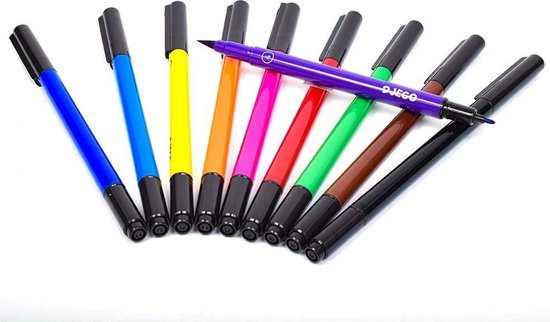
The width and height of the screenshot is (550, 322). I want to click on pen, so click(x=71, y=112), click(x=133, y=113), click(x=176, y=121), click(x=218, y=120), click(x=255, y=120), click(x=298, y=119), click(x=331, y=143), click(x=368, y=158), click(x=394, y=176), click(x=327, y=80).